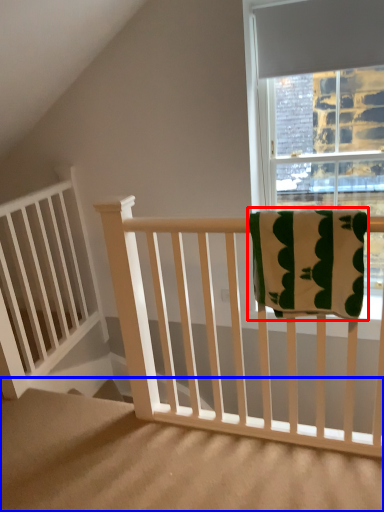
Question: Which object is closer to the camera taking this photo, beach towel (highlighted by a red box) or stairs (highlighted by a blue box)?

Choices:
 (A) beach towel
 (B) stairs

Answer: (B)